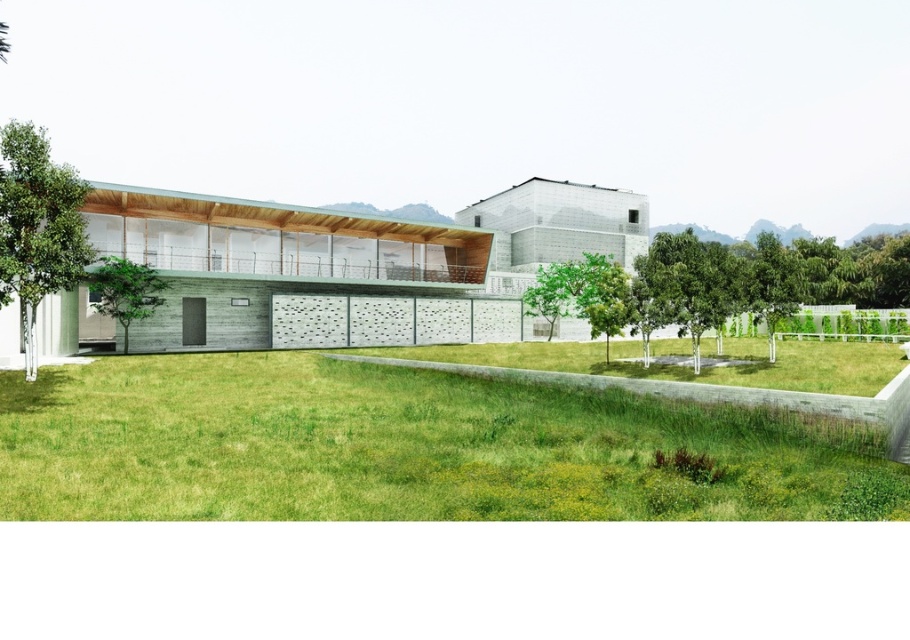
Question: In this image, where is green leafy tree at left located relative to green textured tree at left?

Choices:
 (A) below
 (B) above

Answer: (B)

Question: Which point is farther from the camera taking this photo?

Choices:
 (A) (725, 442)
 (B) (737, 252)

Answer: (B)

Question: Does green grass at lower center lie behind green leafy tree at left?

Choices:
 (A) yes
 (B) no

Answer: (B)

Question: Is green leafy tree at lower right thinner than green leafy tree at left?

Choices:
 (A) no
 (B) yes

Answer: (A)

Question: Which object appears closest to the camera in this image?

Choices:
 (A) green textured tree at left
 (B) green leafy tree at left
 (C) green grass at lower center
 (D) green leafy tree at lower right

Answer: (C)

Question: Which point is closer to the camera?

Choices:
 (A) (905, 513)
 (B) (708, 310)

Answer: (A)